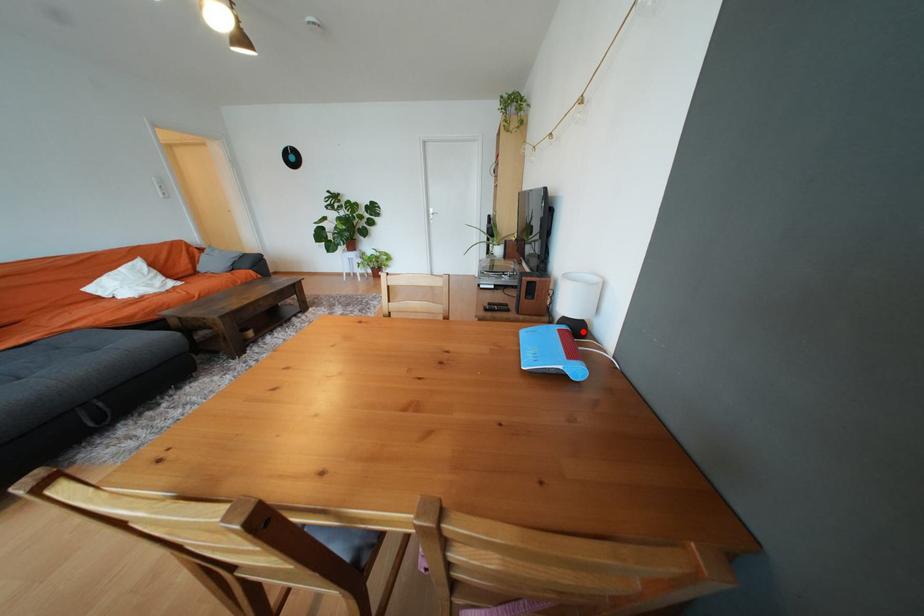
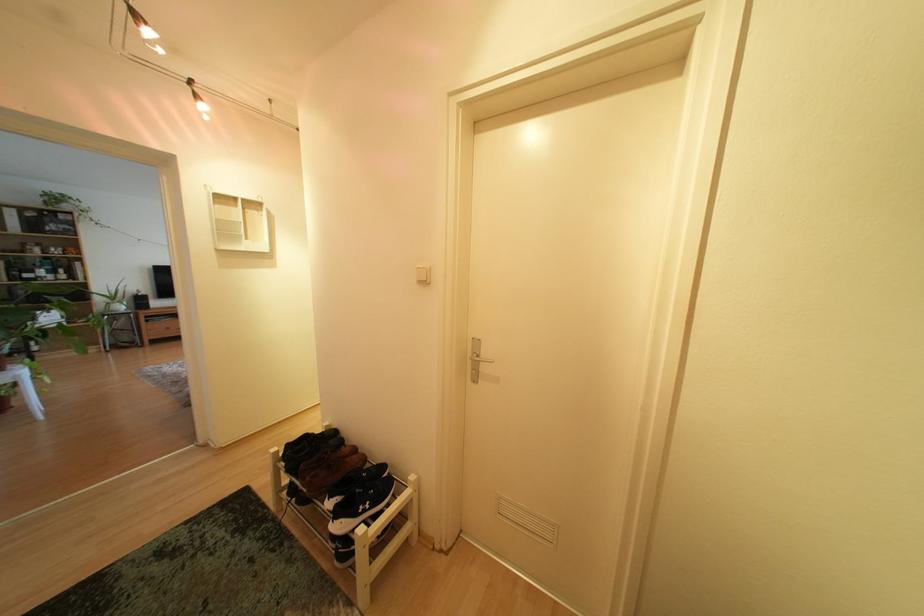
Question: I am providing you with two images of the same scene from different viewpoints. A red point is marked on the first image. Can you still see the location of the red point in image 2?

Choices:
 (A) Yes
 (B) No

Answer: (B)